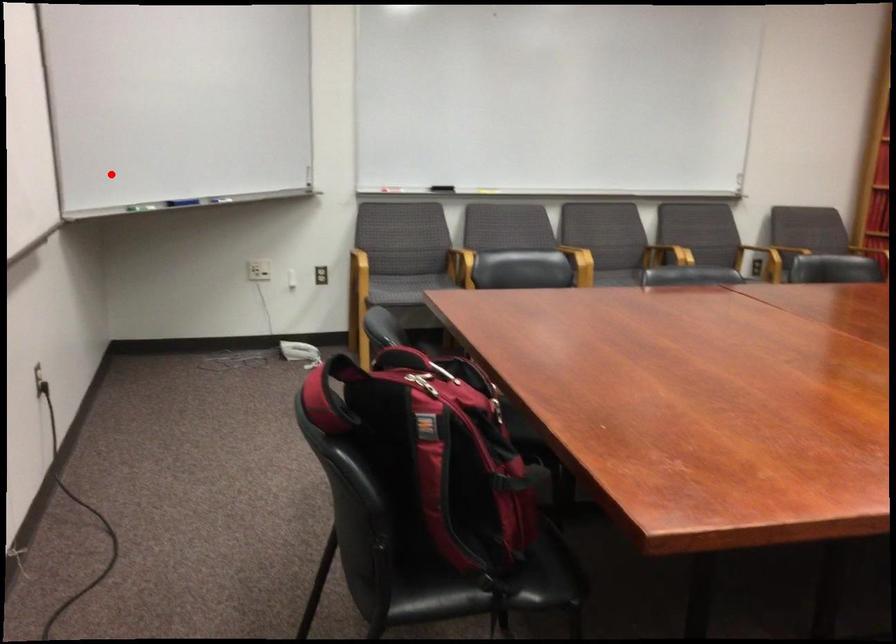
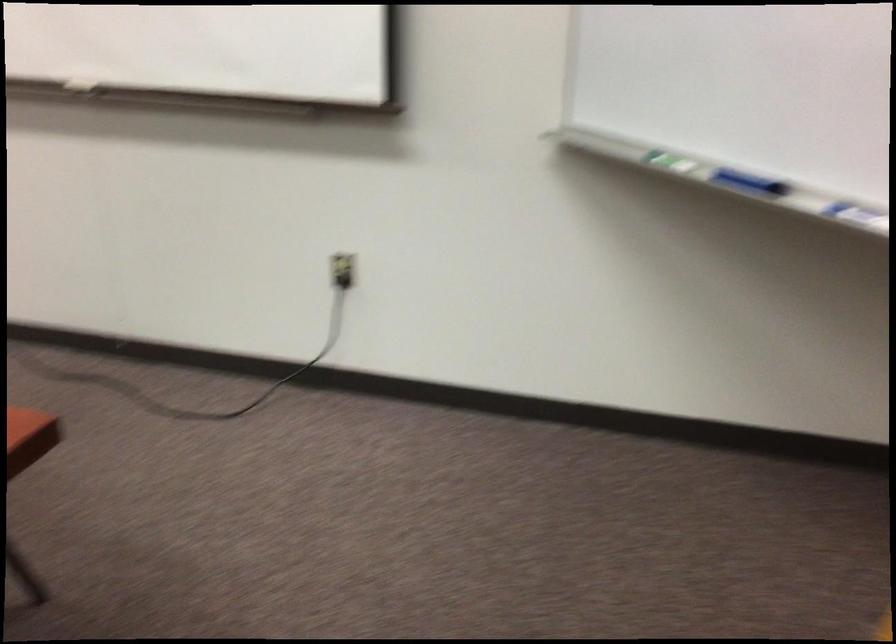
Where in the second image is the point corresponding to the highlighted location from the first image?

(675, 162)